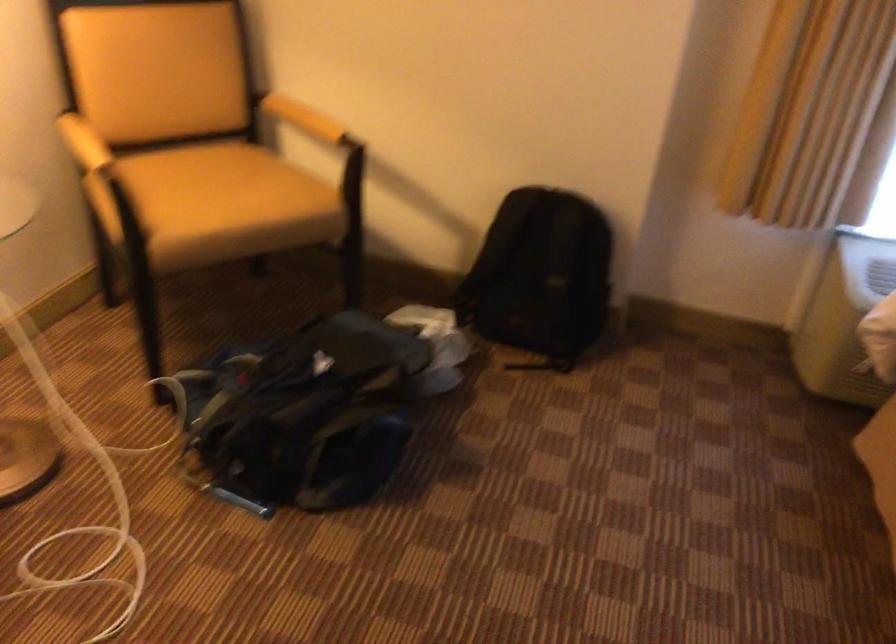
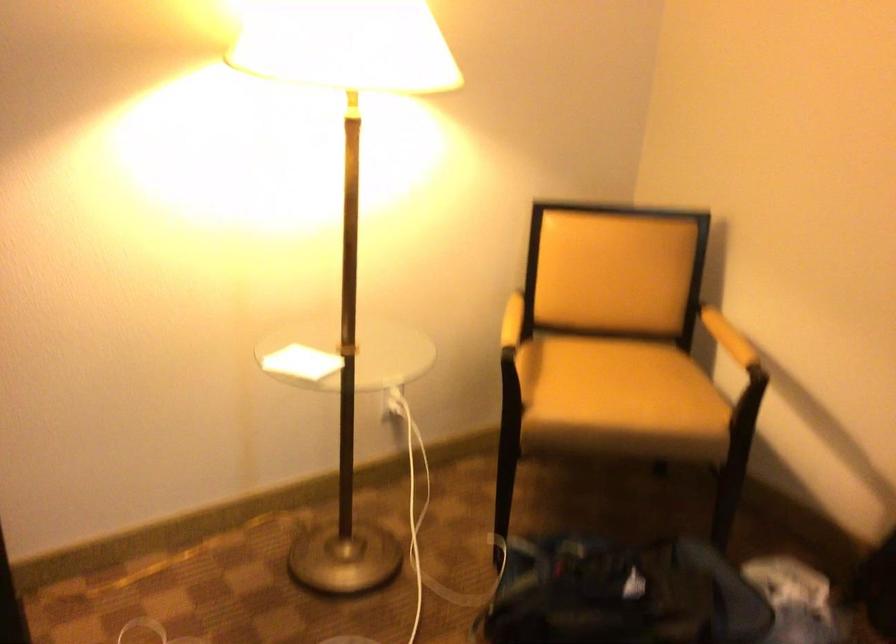
Locate, in the second image, the point that corresponds to (319,118) in the first image.

(728, 337)